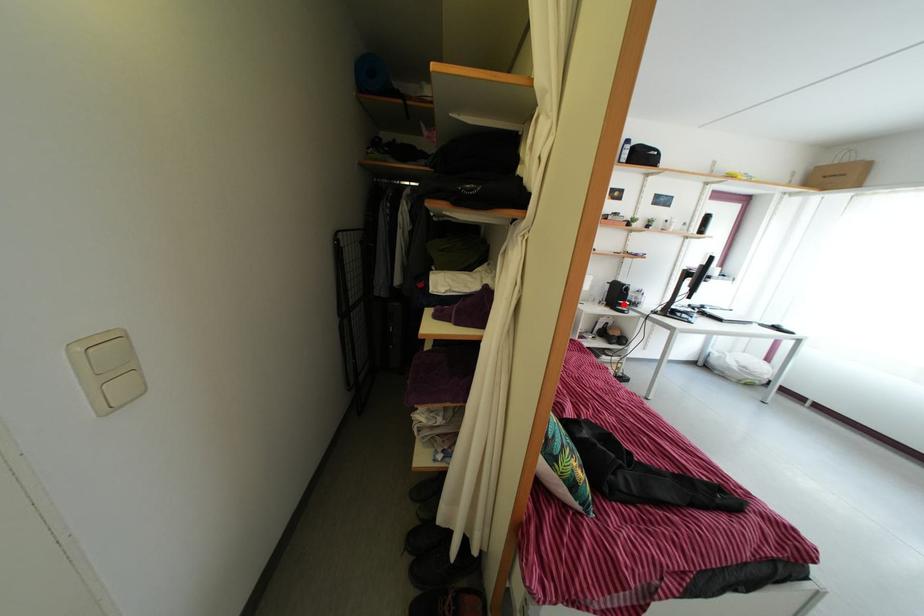
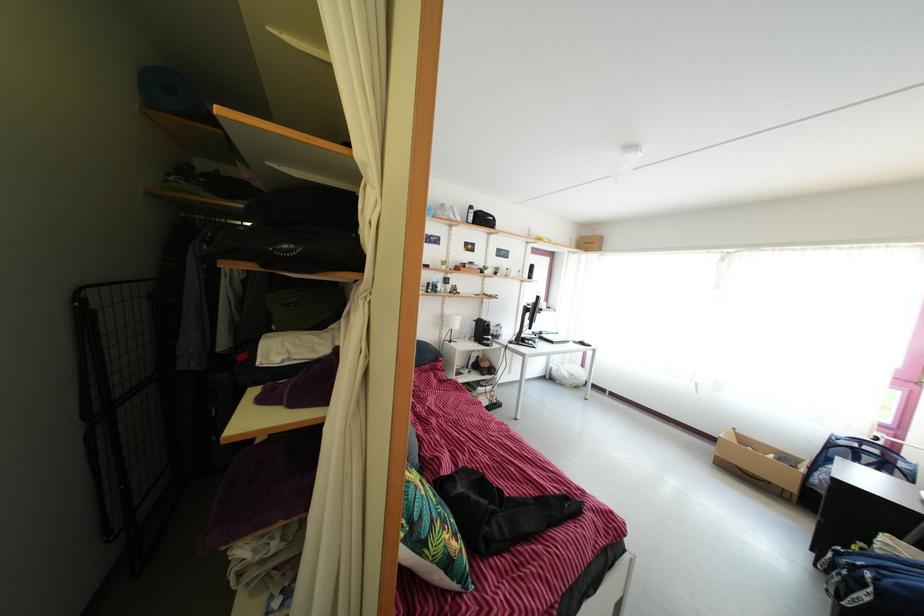
The point at the highlighted location is marked in the first image. Where is the corresponding point in the second image?

(489, 339)